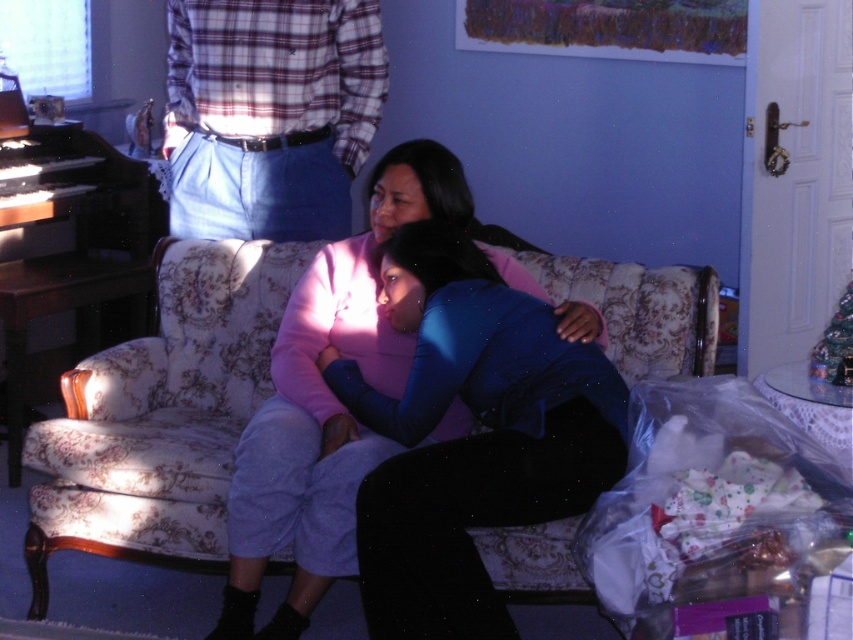
Between point (643, 362) and point (434, 573), which one is positioned behind?

Positioned behind is point (643, 362).

Can you confirm if floral fabric couch at center is smaller than blue matte shirt at center?

Actually, floral fabric couch at center might be larger than blue matte shirt at center.

Is point (560, 538) closer to camera compared to point (376, 412)?

Yes, it is.

This screenshot has width=853, height=640. In order to click on floral fabric couch at center in this screenshot , I will do `click(161, 416)`.

Is floral fabric couch at center thinner than plaid fabric shirt at upper center?

Incorrect, floral fabric couch at center's width is not less than plaid fabric shirt at upper center's.

Does floral fabric couch at center lie in front of plaid fabric shirt at upper center?

Yes, floral fabric couch at center is in front of plaid fabric shirt at upper center.

Where is `floral fabric couch at center`? The image size is (853, 640). floral fabric couch at center is located at coordinates (161, 416).

The height and width of the screenshot is (640, 853). Identify the location of floral fabric couch at center. (161, 416).

Between blue matte shirt at center and plaid fabric shirt at upper center, which one is positioned higher?

plaid fabric shirt at upper center is above.

Is point (460, 291) behind point (364, 29)?

No.

Who is more distant from viewer, (345, 397) or (339, 138)?

The point (339, 138) is behind.

Find the location of a particular element. This screenshot has width=853, height=640. blue matte shirt at center is located at coordinates (469, 436).